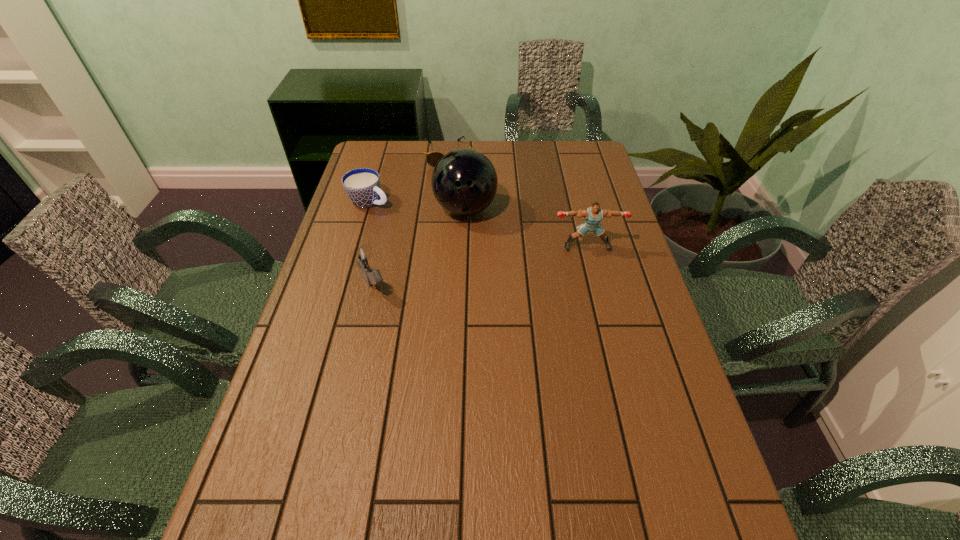
Image resolution: width=960 pixels, height=540 pixels. I want to click on the nearest object, so click(x=359, y=256).

I want to click on the third shortest object, so click(359, 256).

The height and width of the screenshot is (540, 960). What are the coordinates of `the fourth farthest object` in the screenshot? It's located at (593, 215).

This screenshot has width=960, height=540. I want to click on the fourth shortest object, so click(x=593, y=215).

Identify the location of the second shortest object. (362, 186).

At what (x,y) coordinates should I click in order to perform the action: click on the shortest object. Please return your answer as a coordinate pair (x, y). This screenshot has height=540, width=960. Looking at the image, I should click on (432, 158).

Find the location of a particular element. the farthest object is located at coordinates pos(432,158).

This screenshot has width=960, height=540. Find the location of `the tallest object`. the tallest object is located at coordinates (464, 182).

At what (x,y) coordinates should I click in order to perform the action: click on vacant space located on the right of the nearest object. Please return your answer as a coordinate pair (x, y). This screenshot has height=540, width=960. Looking at the image, I should click on (501, 286).

This screenshot has width=960, height=540. What are the coordinates of `vacant space located 0.260m on the front-facing side of the second tallest object` in the screenshot? It's located at (605, 320).